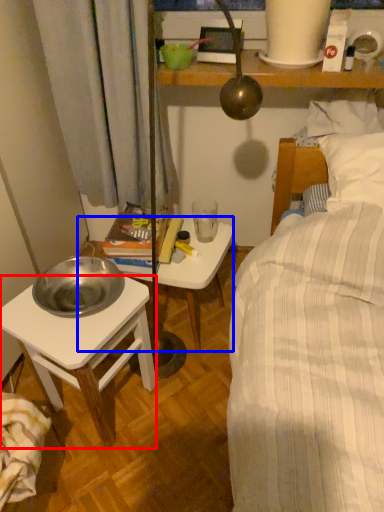
Question: Which object appears closest to the camera in this image, desk (highlighted by a red box) or table (highlighted by a blue box)?

Choices:
 (A) desk
 (B) table

Answer: (A)